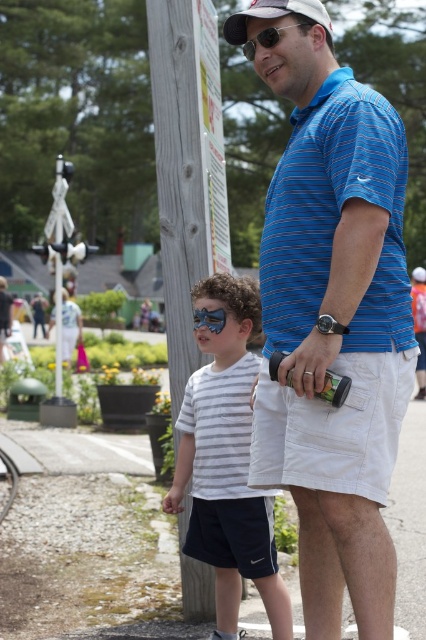
You are taking a photo of the scene and want to focus on both the man and the boy. Based on their positions, which point is closer to the camera, point (255, 518) or point (293, 12)?

Point (255, 518) is further to the camera than point (293, 12), so point (293, 12) is closer to the camera.

You are a person who wants to place a 30 inch long object between the wooden post at center and the blue reflective goggles at center. Can the object fit in the space between them?

The wooden post at center is 31.85 inches away from blue reflective goggles at center, so yes, the 30 inch long object can fit in the space between them since the distance is greater than the object length.